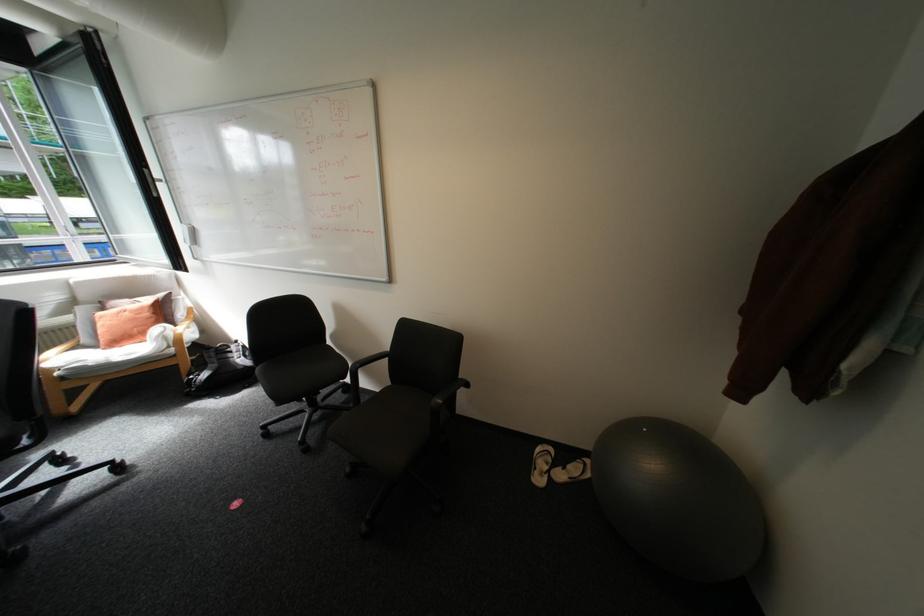
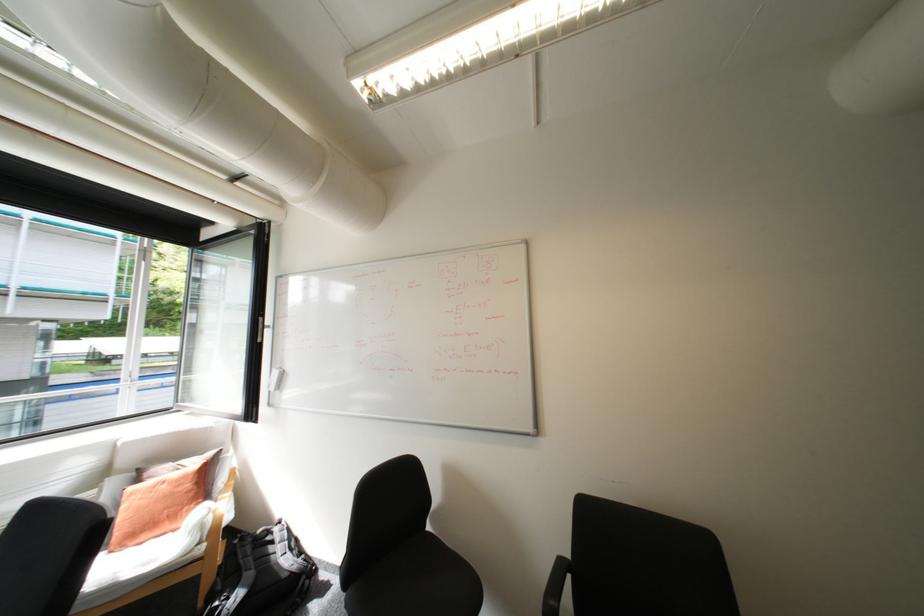
Where in the second image is the point corresponding to pixel 114 349 from the first image?

(122, 552)